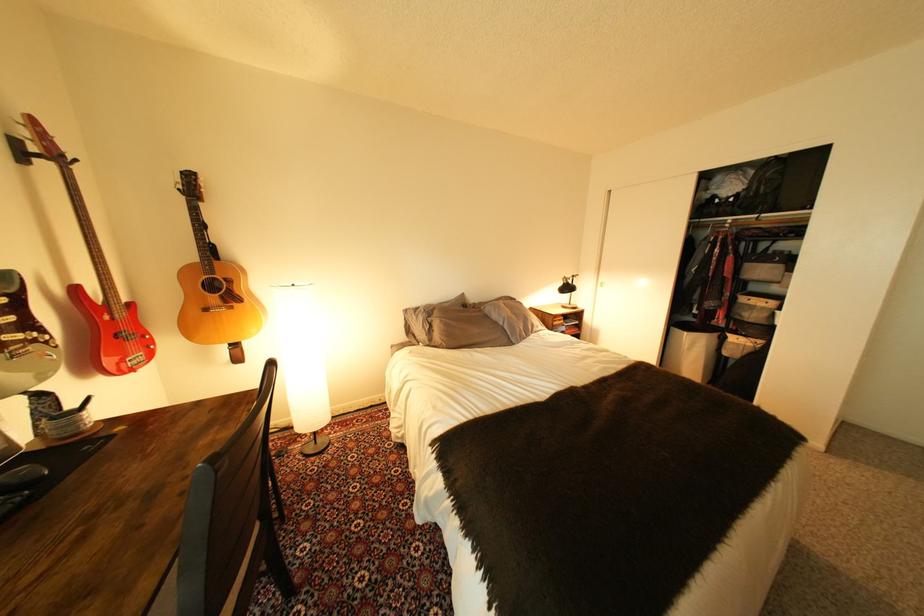
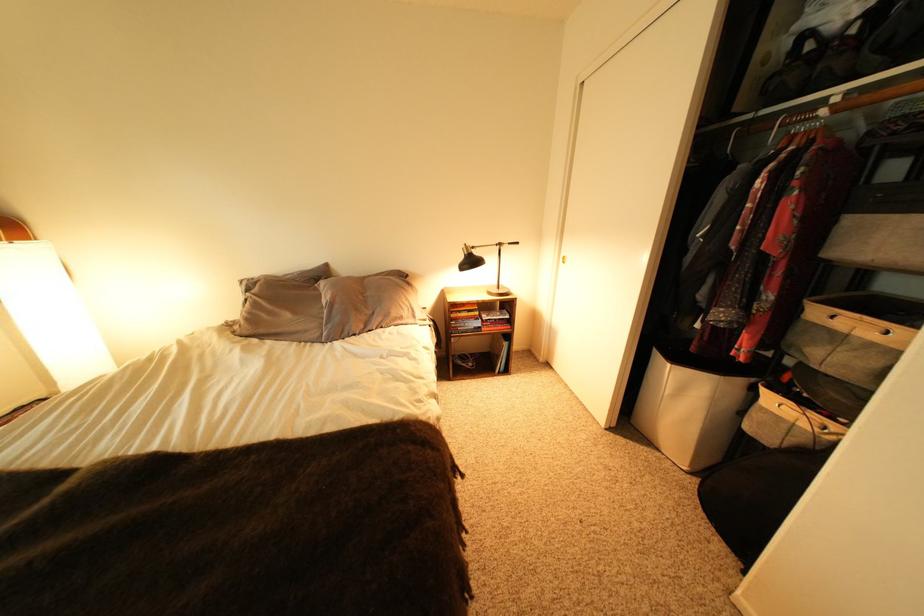
What movement of the cameraman would produce the second image?

The cameraman moved toward right, forward.